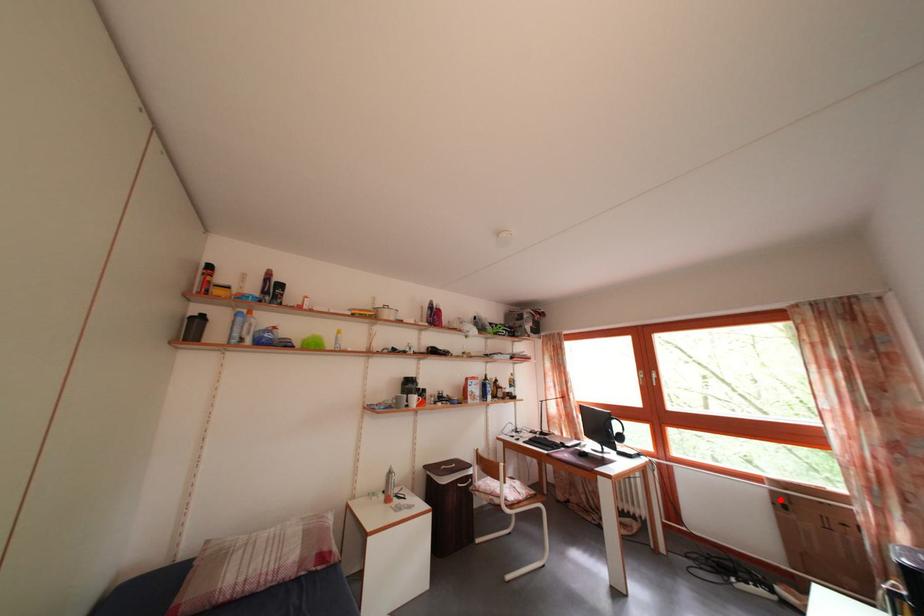
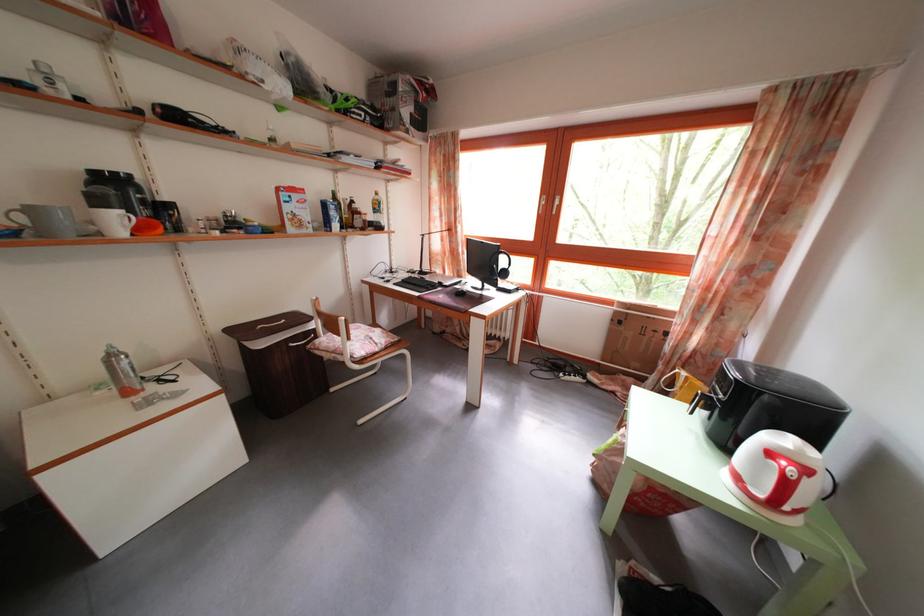
Question: I am providing you with two images of the same scene from different viewpoints. A red point is shown in image1. For the corresponding object point in image2, is it positioned nearer or farther from the camera?

Choices:
 (A) Nearer
 (B) Farther

Answer: (B)